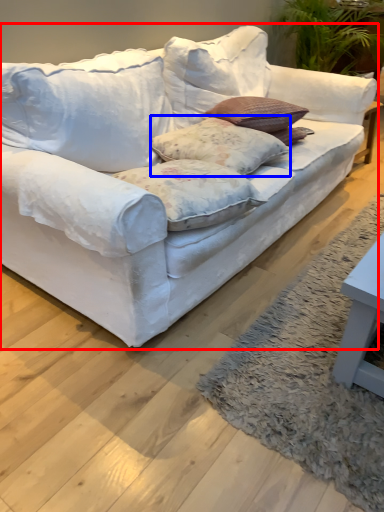
Question: Among these objects, which one is nearest to the camera, studio couch (highlighted by a red box) or pillow (highlighted by a blue box)?

Choices:
 (A) studio couch
 (B) pillow

Answer: (A)